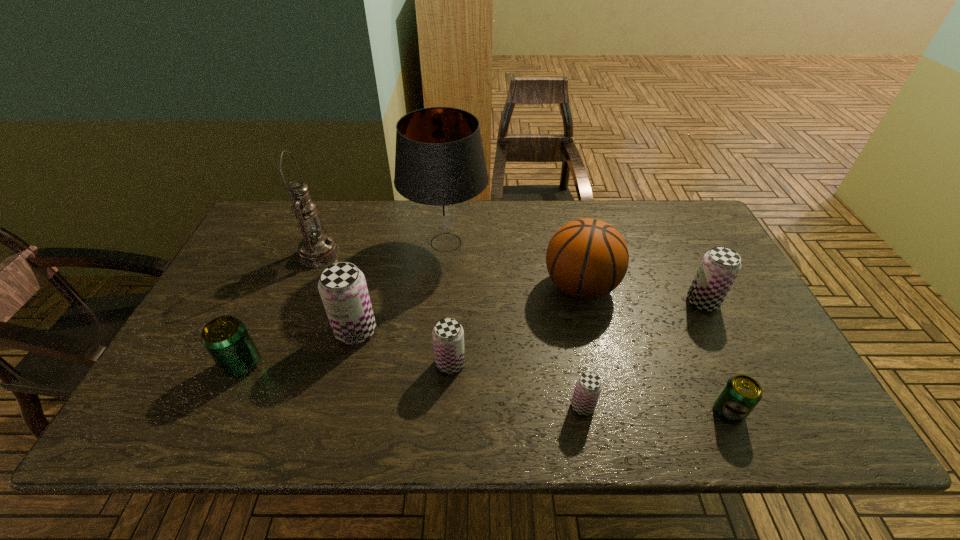
Find the location of `the farther green beer can`. the farther green beer can is located at coordinates (226, 339).

Identify the location of the nearest purple beer can. (588, 387).

Locate an element on the screen. The height and width of the screenshot is (540, 960). the smallest purple beer can is located at coordinates (588, 387).

The height and width of the screenshot is (540, 960). In order to click on the smaller green beer can in this screenshot , I will do `click(741, 393)`.

Image resolution: width=960 pixels, height=540 pixels. In order to click on the nearer green beer can in this screenshot , I will do 741,393.

In order to click on vacant space located on the front of the gray lampshade in this screenshot , I will do `click(435, 367)`.

At what (x,y) coordinates should I click in order to perform the action: click on vacant space located 0.210m on the front of the oil lamp. Please return your answer as a coordinate pair (x, y). Looking at the image, I should click on (292, 323).

At what (x,y) coordinates should I click in order to perform the action: click on vacant point located on the left of the brown basketball. Please return your answer as a coordinate pair (x, y). This screenshot has height=540, width=960. Looking at the image, I should click on (410, 286).

The width and height of the screenshot is (960, 540). I want to click on free region located 0.160m on the back of the tallest beer can, so click(371, 273).

Locate an element on the screen. This screenshot has width=960, height=540. vacant space situated on the back of the third smallest purple beer can is located at coordinates (669, 234).